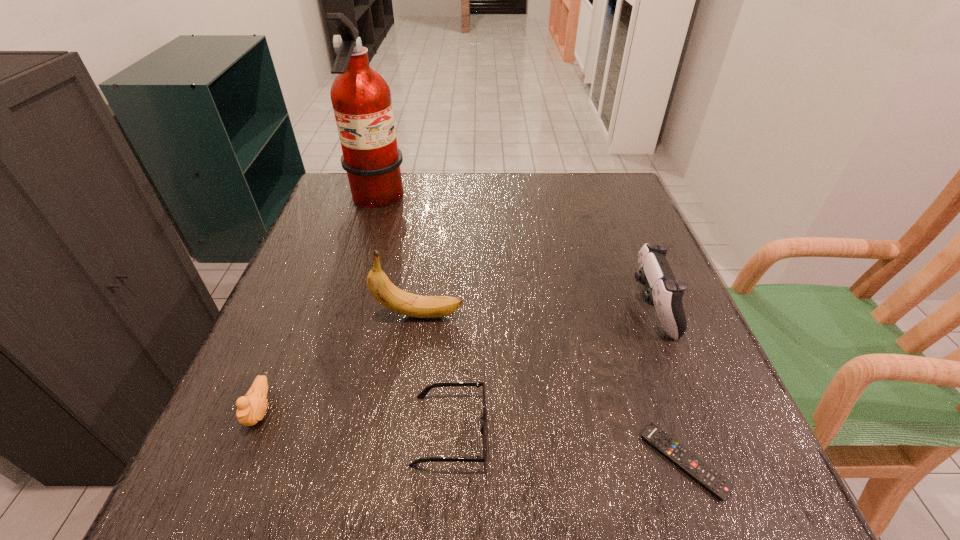
Find the location of a particular element. This screenshot has width=960, height=540. free space between the fifth shortest object and the control is located at coordinates (536, 311).

I want to click on free spot between the farthest object and the control, so click(514, 254).

The width and height of the screenshot is (960, 540). I want to click on vacant space that is in between the third tallest object and the duckling, so click(x=455, y=359).

Where is `vacant space that's between the tallest object and the third shortest object`? vacant space that's between the tallest object and the third shortest object is located at coordinates [318, 305].

You are a GUI agent. You are given a task and a screenshot of the screen. Output one action in this format:
    pyautogui.click(x=<x>, y=<y>)
    Task: Click on the unoccupied position between the fourth shortest object and the tallest object
    The width and height of the screenshot is (960, 540).
    Given the screenshot: What is the action you would take?
    pyautogui.click(x=514, y=254)

At what (x,y) coordinates should I click in order to perform the action: click on free spot between the farthest object and the control. Please return your answer as a coordinate pair (x, y). This screenshot has width=960, height=540. Looking at the image, I should click on (514, 254).

Where is `free space between the shortest object and the banana`? This screenshot has width=960, height=540. free space between the shortest object and the banana is located at coordinates (552, 388).

This screenshot has width=960, height=540. I want to click on vacant area that lies between the second tallest object and the shortest object, so click(552, 388).

In order to click on object that is the second closest one to the control in this screenshot , I will do `click(422, 395)`.

Where is `the second closest object to the third tallest object`? the second closest object to the third tallest object is located at coordinates (422, 395).